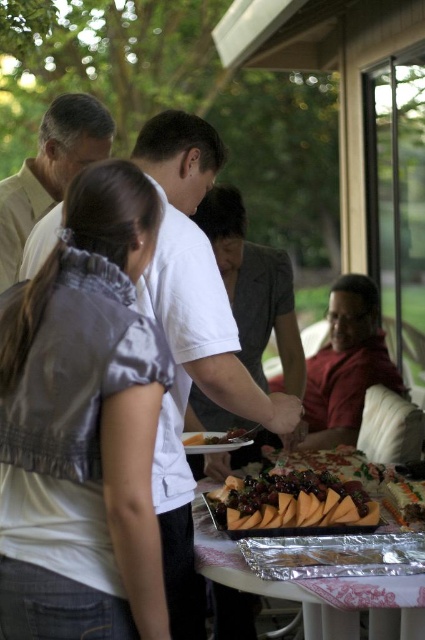
Question: Is white matte shirt at center wider than light brown shirt at upper left?

Choices:
 (A) no
 (B) yes

Answer: (B)

Question: Which point appears closest to the camera in this image?

Choices:
 (A) (59, 147)
 (B) (96, 275)
 (C) (193, 282)

Answer: (B)

Question: Which point appears closest to the camera in this image?

Choices:
 (A) (99, 477)
 (B) (180, 250)
 (C) (334, 369)
 (D) (317, 628)

Answer: (A)

Question: Which of the following is the farthest from the observer?

Choices:
 (A) (84, 108)
 (B) (311, 404)

Answer: (B)

Question: Is gray satin blouse at center smaller than sliced orange cheese at center?

Choices:
 (A) no
 (B) yes

Answer: (A)

Question: From the image, what is the correct spatial relationship of white matte shirt at center in relation to sliced cheese at center?

Choices:
 (A) below
 (B) above

Answer: (B)